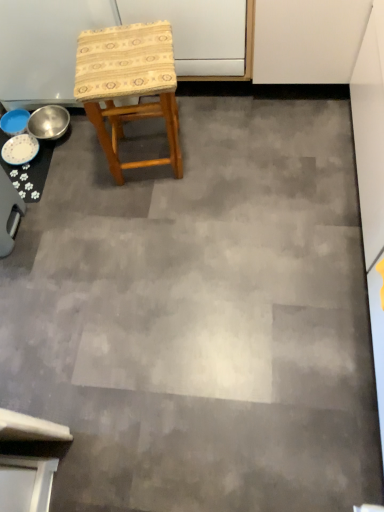
The width and height of the screenshot is (384, 512). I want to click on unoccupied region to the right of woven fabric stool at center, so click(x=222, y=146).